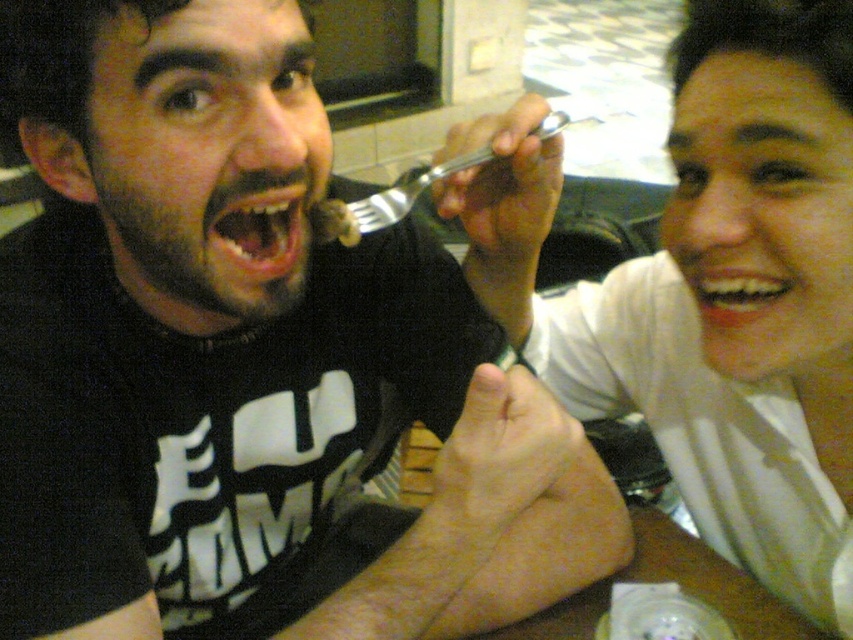
You are a waiter in a restaurant and you see two forks, a matte black fork at upper center and a matte plastic fork at upper center. Which fork should you choose to give to the customer if the customer prefers a larger fork?

The matte black fork at upper center is bigger than the matte plastic fork at upper center, so you should choose the matte black fork at upper center to give to the customer.

You are a waiter in a restaurant. You need to place a small bowl of soup in a position that is exactly halfway between the person on the left and the point at coordinates point (x=242, y=360). Where should you place the bowl?

The point at coordinates point (x=242, y=360) is on the matte black fork at upper center. To place the bowl halfway between the person on the left and this point, you should position it along the line connecting the two, exactly midway between them.